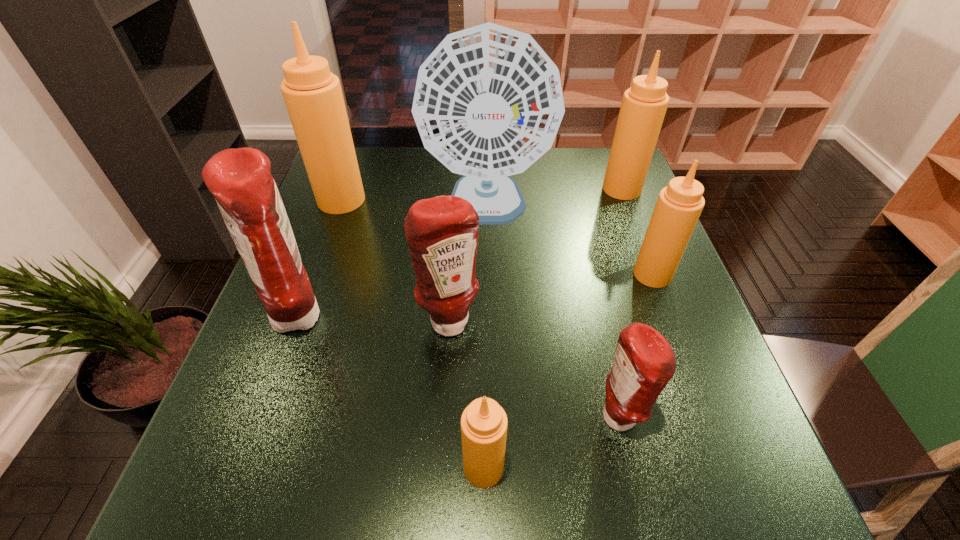
Locate an element on the screen. The height and width of the screenshot is (540, 960). fan located at the far edge is located at coordinates (488, 102).

Find the location of `object present at the near edge`. object present at the near edge is located at coordinates (484, 423).

Find the location of a particular element. object located at the far left corner is located at coordinates (313, 96).

Locate an element on the screen. object that is at the far right corner is located at coordinates (644, 104).

This screenshot has width=960, height=540. Find the location of `free space at the far edge of the desktop`. free space at the far edge of the desktop is located at coordinates (551, 151).

I want to click on vacant point at the near edge, so click(567, 471).

This screenshot has height=540, width=960. I want to click on vacant space at the left edge of the desktop, so click(x=243, y=357).

Identify the location of vacant space at the right edge. Image resolution: width=960 pixels, height=540 pixels. (598, 210).

Identify the location of vacant area at the near right corner of the desktop. coord(731,475).

The image size is (960, 540). What are the coordinates of `vacant space that is in between the leftmost tan condiment and the fan` in the screenshot? It's located at (414, 204).